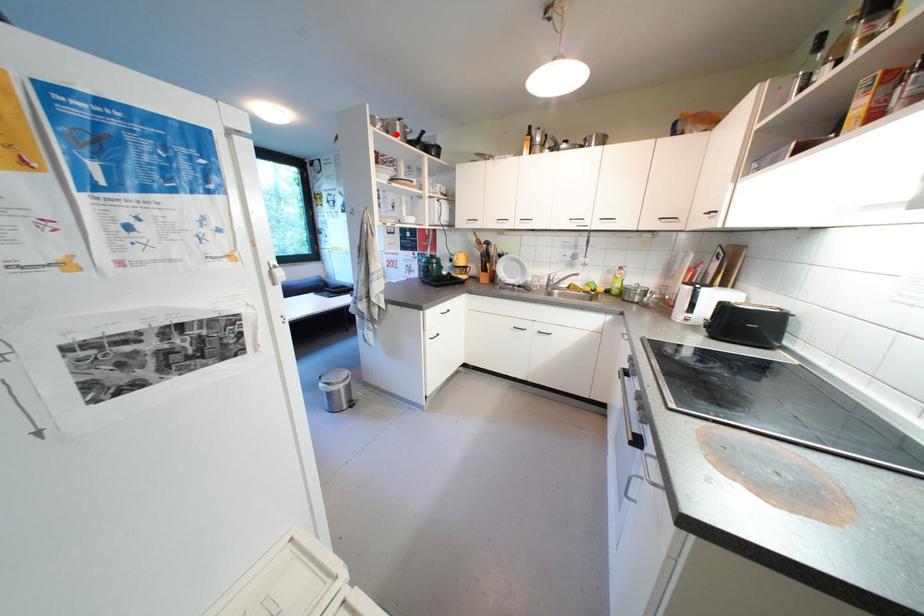
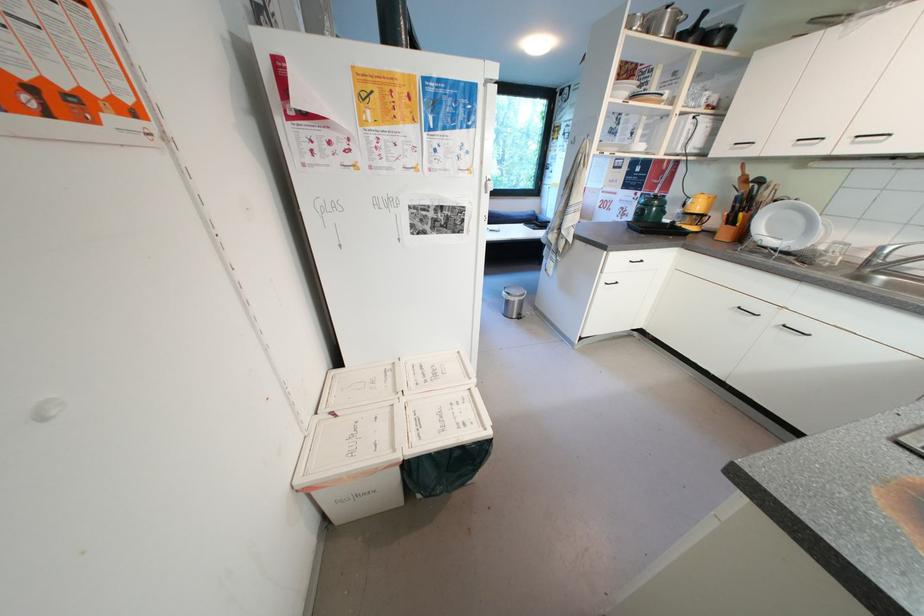
The point at the highlighted location is marked in the first image. Where is the corresponding point in the second image?

(657, 33)